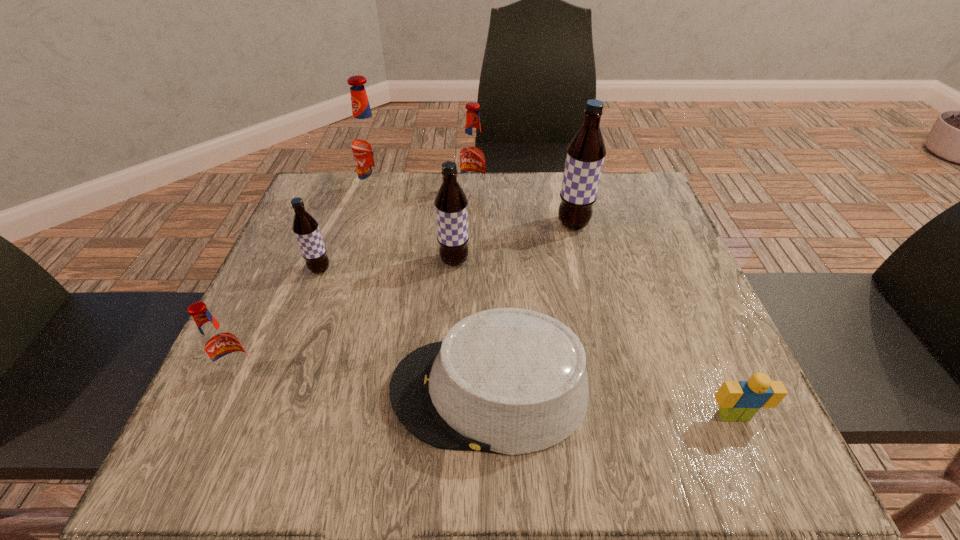
Locate an element on the screen. the biggest red root beer is located at coordinates (368, 142).

Locate an element on the screen. This screenshot has height=540, width=960. the fourth root beer from right to left is located at coordinates (368, 142).

Locate an element on the screen. The image size is (960, 540). the biggest brown root beer is located at coordinates (586, 152).

You are a GUI agent. You are given a task and a screenshot of the screen. Output one action in this format:
    pyautogui.click(x=<x>, y=<y>)
    Task: Click on the third farthest object
    Image resolution: width=960 pixels, height=540 pixels.
    Given the screenshot: What is the action you would take?
    pyautogui.click(x=586, y=152)

Find the location of a particular element. The width and height of the screenshot is (960, 540). the second biggest red root beer is located at coordinates (473, 157).

Locate an element on the screen. the second biggest brown root beer is located at coordinates (451, 204).

Find the location of a particular element. This screenshot has width=960, height=540. the seventh object from right to left is located at coordinates (305, 227).

Identify the location of the smallest brown root beer. (305, 227).

I want to click on the leftmost object, so click(222, 347).

You are a GUI agent. You are given a task and a screenshot of the screen. Output one action in this format:
    pyautogui.click(x=<x>, y=<y>)
    Task: Click on the nearest root beer
    This screenshot has width=960, height=540.
    Given the screenshot: What is the action you would take?
    pyautogui.click(x=222, y=347)